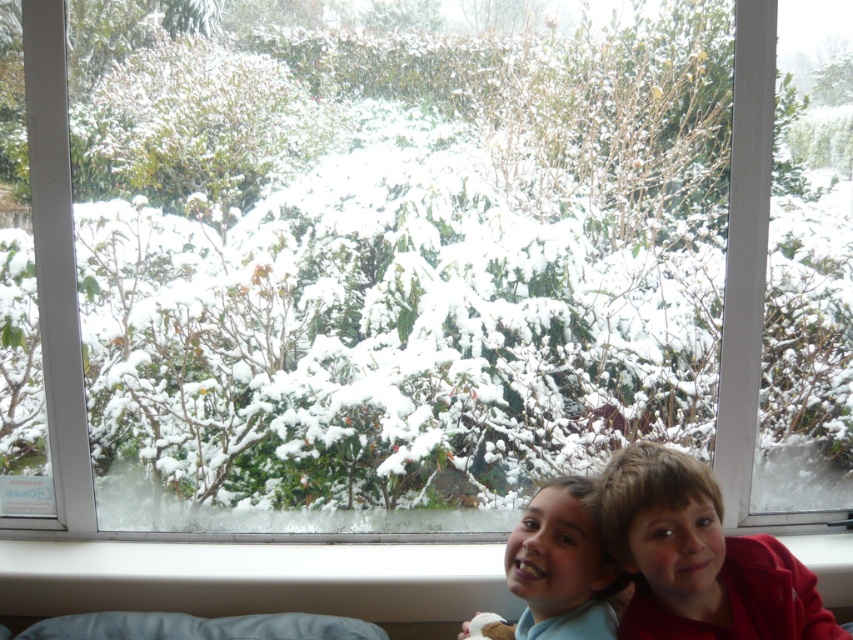
Question: Is red cotton shirt at lower right above white soft pillow at lower center?

Choices:
 (A) no
 (B) yes

Answer: (B)

Question: Is red cotton shirt at lower right further to the viewer compared to white soft pillow at lower center?

Choices:
 (A) yes
 (B) no

Answer: (B)

Question: Which object is the farthest from the smooth skin child at lower center?

Choices:
 (A) red cotton shirt at lower right
 (B) white soft pillow at lower center

Answer: (B)

Question: Which object is the closest to the white soft pillow at lower center?

Choices:
 (A) smooth skin child at lower center
 (B) white plastic window sill at lower center
 (C) red cotton shirt at lower right

Answer: (B)

Question: Considering the relative positions of red cotton shirt at lower right and smooth skin child at lower center in the image provided, where is red cotton shirt at lower right located with respect to smooth skin child at lower center?

Choices:
 (A) right
 (B) left

Answer: (A)

Question: Among these objects, which one is farthest from the camera?

Choices:
 (A) red cotton shirt at lower right
 (B) white plastic window sill at lower center

Answer: (B)